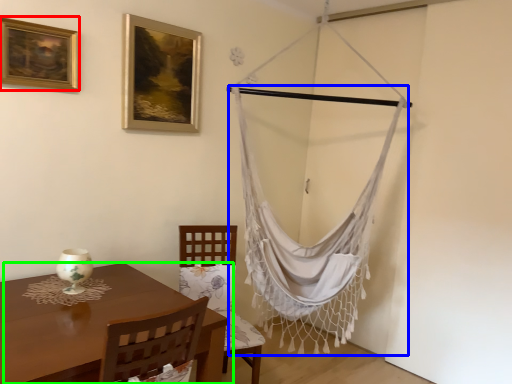
Question: Estimate the real-world distances between objects in this image. Which object is farther from picture frame (highlighted by a red box), curtain (highlighted by a blue box) or table (highlighted by a green box)?

Choices:
 (A) curtain
 (B) table

Answer: (A)